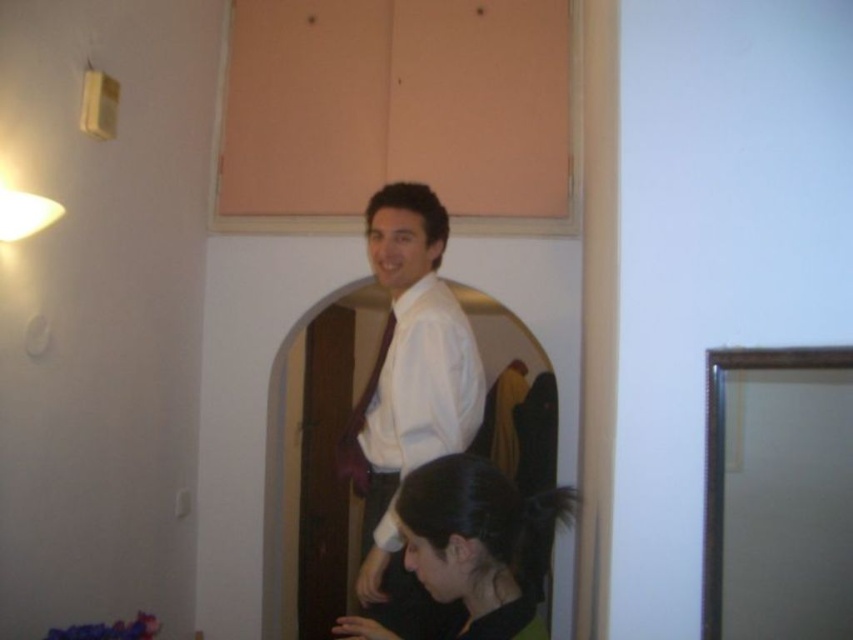
You are a photographer standing at the camera position. You want to take a portrait of the man wearing the white glossy shirt at center. What is the minimum distance you should keep between yourself and the subject to ensure the entire shirt is in frame?

The minimum distance you should keep between yourself and the subject is 1.55 meters to ensure the entire white glossy shirt at center is in frame.

You are a photographer setting up a shoot in the room. You notice the black matte hair at center and the matte brown tie at center. Which object is located higher up on the person?

The matte brown tie at center is located higher up on the person than the black matte hair at center.

You are standing in the residential space and want to move from the point at coordinates point (378, 612) to the point at coordinates point (448, 547). Can you walk directly between them without any obstacles?

Point (378, 612) is behind point (448, 547), so you cannot walk directly between them without going around the obstacle in front.